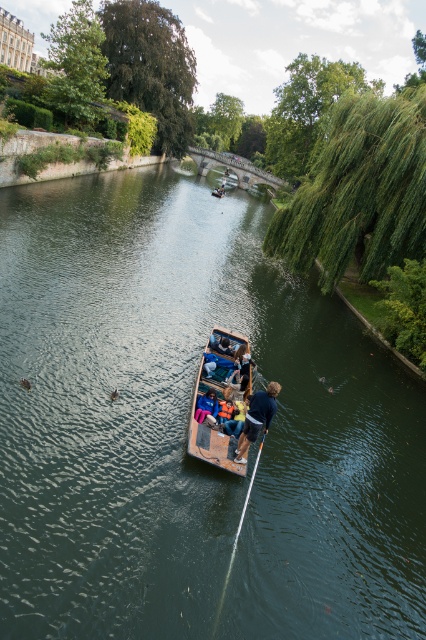
Question: Which object is the farthest from the wooden boat at center?

Choices:
 (A) blue fabric jacket at center
 (B) blue denim jacket at center
 (C) white plastic paddle at center

Answer: (C)

Question: Can you confirm if white plastic paddle at center is smaller than blue denim jacket at center?

Choices:
 (A) no
 (B) yes

Answer: (B)

Question: Where is blue fabric jacket at center located in relation to blue denim jacket at center in the image?

Choices:
 (A) above
 (B) below

Answer: (B)

Question: Which object is closer to the camera taking this photo?

Choices:
 (A) white plastic paddle at center
 (B) wooden boat at center

Answer: (A)

Question: Is white plastic paddle at center smaller than blue denim jacket at center?

Choices:
 (A) no
 (B) yes

Answer: (B)

Question: Which point is farther from the camera taking this photo?

Choices:
 (A) (216, 371)
 (B) (264, 401)
 (C) (256, 452)
 (D) (198, 404)

Answer: (A)